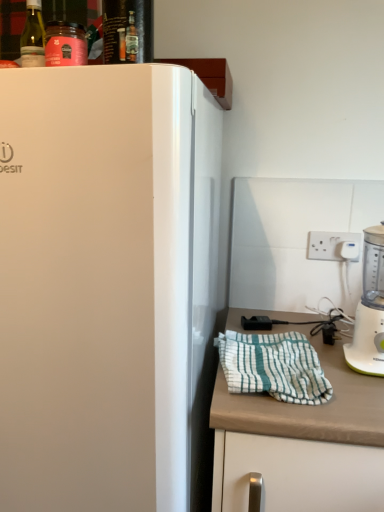
Question: Is white plastic blender at right positioned with its back to shiny glass bottle at upper center?

Choices:
 (A) yes
 (B) no

Answer: (B)

Question: Can you confirm if white plastic blender at right is taller than shiny glass bottle at upper center?

Choices:
 (A) yes
 (B) no

Answer: (A)

Question: Is white plastic blender at right thinner than shiny glass bottle at upper center?

Choices:
 (A) no
 (B) yes

Answer: (A)

Question: Is white plastic blender at right to the right of shiny glass bottle at upper center from the viewer's perspective?

Choices:
 (A) no
 (B) yes

Answer: (B)

Question: Does white plastic blender at right come in front of shiny glass bottle at upper center?

Choices:
 (A) no
 (B) yes

Answer: (A)

Question: Looking at the image, does green glass bottle at upper left seem bigger or smaller compared to white glossy refrigerator at left?

Choices:
 (A) big
 (B) small

Answer: (B)

Question: Considering the positions of point (34, 19) and point (13, 365), is point (34, 19) closer or farther from the camera than point (13, 365)?

Choices:
 (A) closer
 (B) farther

Answer: (A)

Question: Is green glass bottle at upper left spatially inside white glossy refrigerator at left, or outside of it?

Choices:
 (A) inside
 (B) outside

Answer: (B)

Question: Looking at their shapes, would you say green glass bottle at upper left is wider or thinner than white glossy refrigerator at left?

Choices:
 (A) thin
 (B) wide

Answer: (A)

Question: Do you think white plastic electric outlet at upper right is within white striped cloth at lower right, or outside of it?

Choices:
 (A) inside
 (B) outside

Answer: (B)

Question: Considering the relative positions of white plastic electric outlet at upper right and white striped cloth at lower right in the image provided, is white plastic electric outlet at upper right to the left or to the right of white striped cloth at lower right?

Choices:
 (A) left
 (B) right

Answer: (B)

Question: Considering the positions of white plastic electric outlet at upper right and white striped cloth at lower right in the image, is white plastic electric outlet at upper right taller or shorter than white striped cloth at lower right?

Choices:
 (A) tall
 (B) short

Answer: (A)

Question: Is white plastic electric outlet at upper right bigger or smaller than white striped cloth at lower right?

Choices:
 (A) small
 (B) big

Answer: (A)

Question: Is white matte countertop at lower right to the left or to the right of white glossy refrigerator at left in the image?

Choices:
 (A) left
 (B) right

Answer: (B)

Question: Relative to white glossy refrigerator at left, is white matte countertop at lower right in front or behind?

Choices:
 (A) behind
 (B) front

Answer: (A)